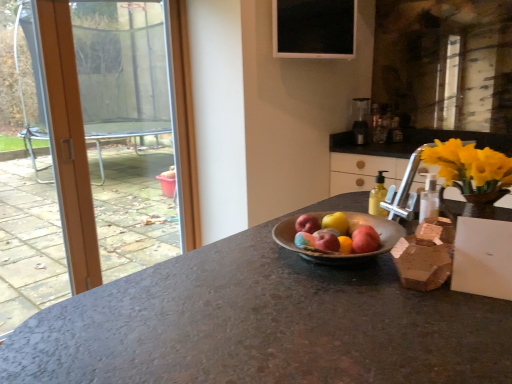
Question: Relative to yellow translucent bottle at right, is red matte apple at center, arranged as the 4th apple when viewed from the front, in front or behind?

Choices:
 (A) front
 (B) behind

Answer: (A)

Question: Is point (330, 221) positioned closer to the camera than point (377, 182)?

Choices:
 (A) farther
 (B) closer

Answer: (B)

Question: Estimate the real-world distances between objects in this image. Which object is closer to the red matte apple at center, which is counted as the second apple, starting from the front?

Choices:
 (A) transparent glass window at upper left
 (B) black glass window screen at upper center
 (C) yellow wood cabinet at upper right
 (D) satin silver blender at upper right
 (E) matte pink apple at center, the 4th apple viewed from the back

Answer: (E)

Question: Considering the real-world distances, which object is closest to the yellow wood cabinet at upper right?

Choices:
 (A) satin silver blender at upper right
 (B) black glass window screen at upper center
 (C) matte pink apple at center, which appears as the 2th apple when viewed from the back
 (D) transparent glass window at upper left
 (E) red matte apple at center, the 3th apple viewed from the back

Answer: (A)